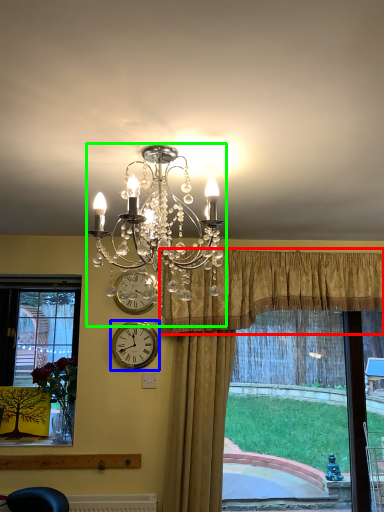
Question: Estimate the real-world distances between objects in this image. Which object is farther from curtain (highlighted by a red box), wall clock (highlighted by a blue box) or lamp (highlighted by a green box)?

Choices:
 (A) wall clock
 (B) lamp

Answer: (B)